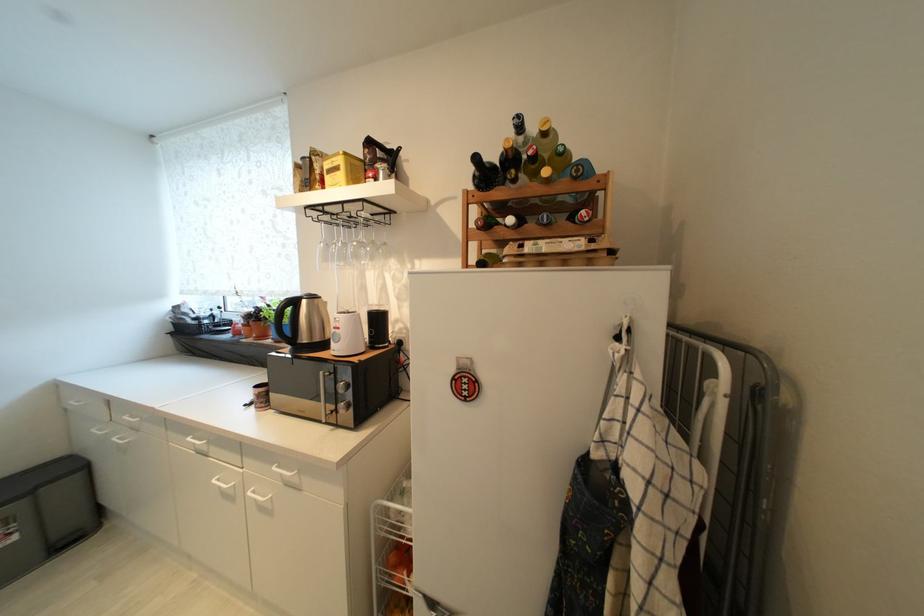
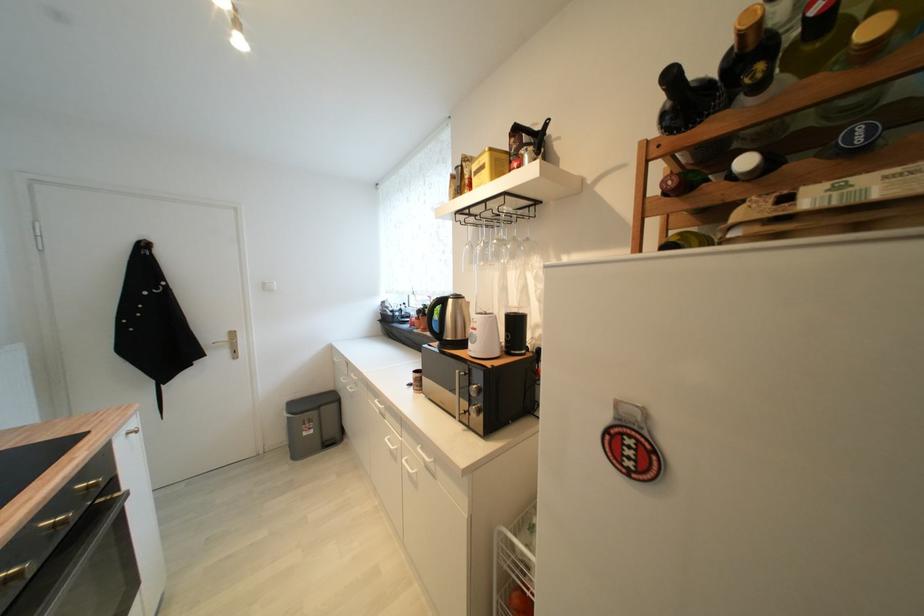
Locate, in the second image, the point that corresponds to point 346,392 in the first image.

(478, 395)